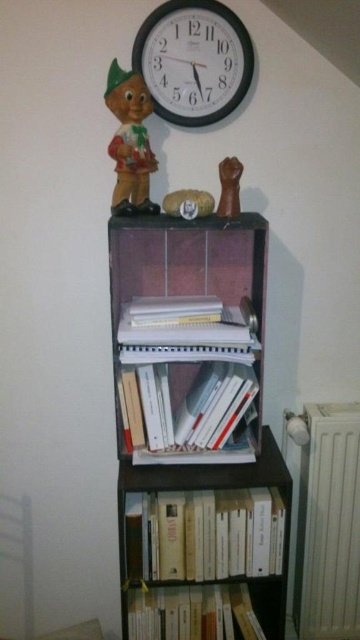
You are organizing a shelf and need to place a new item between the wooden bookshelf at center and the white plastic clock at upper center. Based on their positions, where should the new item be placed?

The wooden bookshelf at center is positioned under the white plastic clock at upper center, so the new item should be placed between them, above the wooden bookshelf at center but below the white plastic clock at upper center.

You are standing in front of a bookshelf and want to reach a point marked as point (146, 83). Can you estimate how far you need to stretch your hand to reach that point?

The point (146, 83) is 1.51 meters away from the viewer, so you need to stretch your hand approximately 1.51 meters to reach it.

You are organizing items on the bookshelf and need to place a new item between the white plastic clock at upper center and the white paper book at center. Where should you place it to ensure it fits between them?

The white plastic clock at upper center is positioned on the right side of the white paper book at center, so placing the new item between them would require placing it to the left of the clock and to the right of the book.